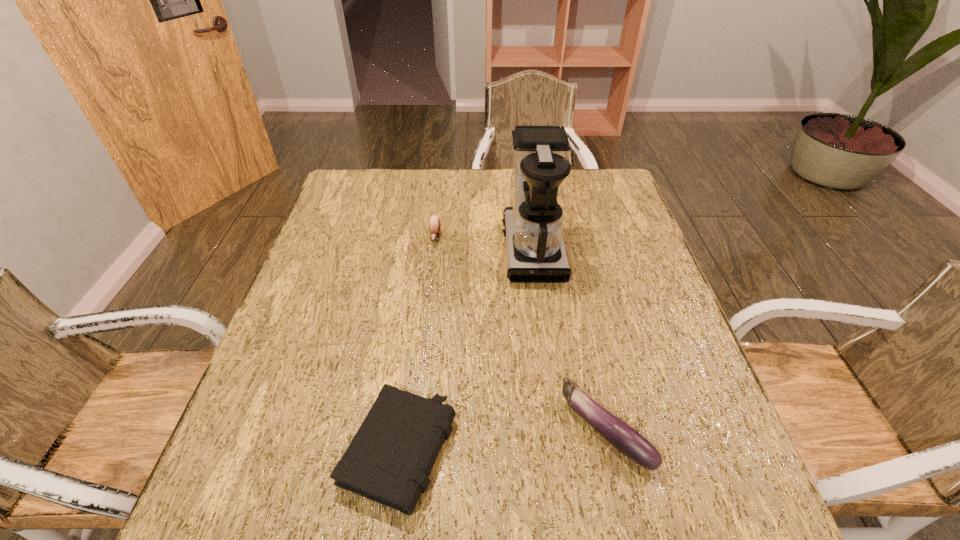
At what (x,y) coordinates should I click in order to perform the action: click on coffee maker. Please return your answer as a coordinate pair (x, y). Looking at the image, I should click on (533, 228).

This screenshot has width=960, height=540. In order to click on escargot in this screenshot , I will do `click(434, 223)`.

At what (x,y) coordinates should I click in order to perform the action: click on Bible. Please return your answer as a coordinate pair (x, y). The width and height of the screenshot is (960, 540). Looking at the image, I should click on (389, 460).

Where is `eggplant`? eggplant is located at coordinates (627, 440).

This screenshot has height=540, width=960. In order to click on vacant region located 0.060m at the front of the tallest object where the controls are located in this screenshot , I will do `click(481, 249)`.

This screenshot has height=540, width=960. What are the coordinates of `vacant position located at the front of the tallest object where the controls are located` in the screenshot? It's located at (383, 249).

The width and height of the screenshot is (960, 540). In order to click on vacant region located 0.330m at the front of the tallest object where the controls are located in this screenshot , I will do `click(383, 249)`.

At what (x,y) coordinates should I click in order to perform the action: click on free space located on the front-facing side of the escargot. Please return your answer as a coordinate pair (x, y). Image resolution: width=960 pixels, height=540 pixels. Looking at the image, I should click on (429, 288).

This screenshot has width=960, height=540. Find the location of `free point located 0.360m on the right of the Bible`. free point located 0.360m on the right of the Bible is located at coordinates (652, 451).

Where is `free spot located 0.100m on the left of the eggplant`? This screenshot has width=960, height=540. free spot located 0.100m on the left of the eggplant is located at coordinates (512, 430).